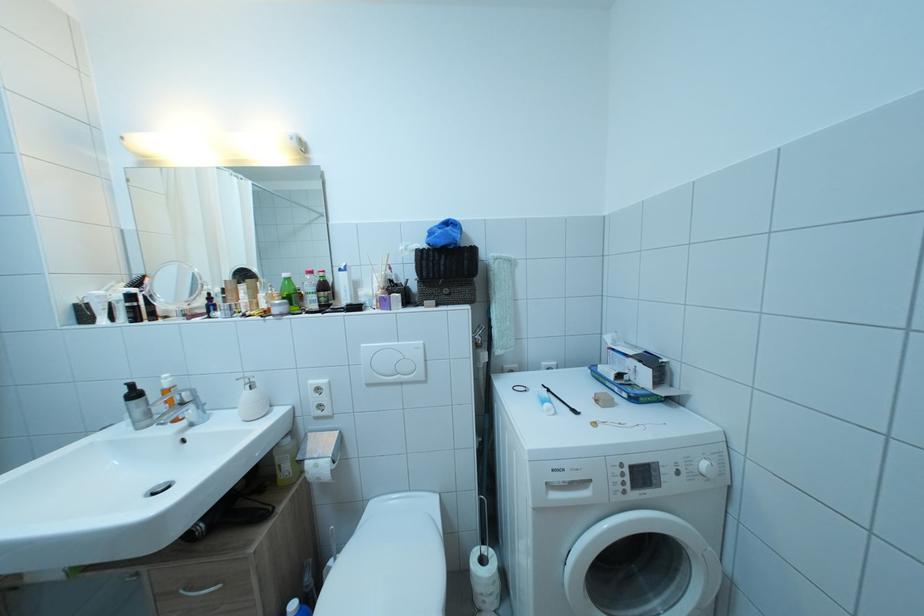
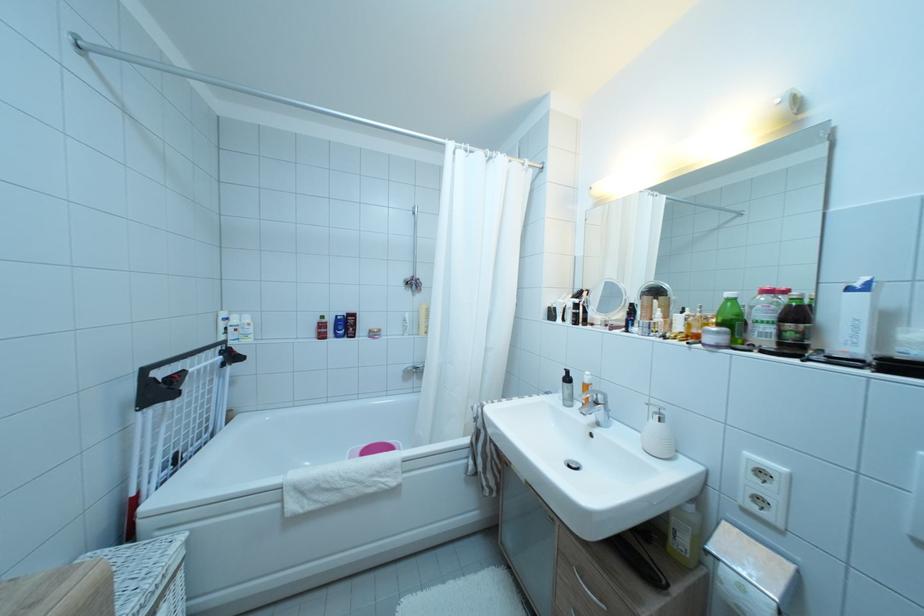
Where in the second image is the point corresponding to (321,302) from the first image?

(776, 334)